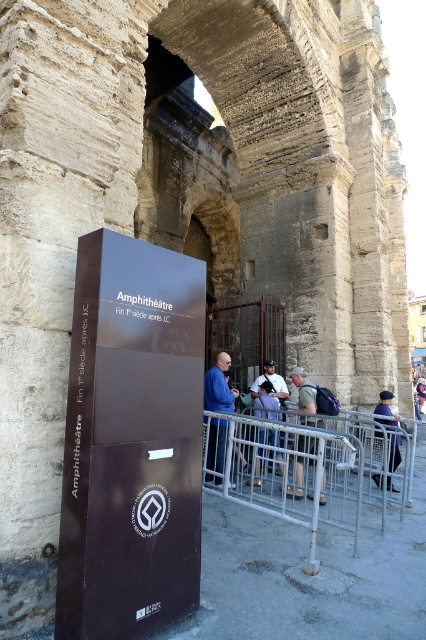
Which is behind, point (397, 490) or point (255, 385)?

Point (255, 385)

Where is `purple fabric bag at lower right`? This screenshot has width=426, height=640. purple fabric bag at lower right is located at coordinates (385, 408).

What are the coordinates of `purple fabric bag at lower right` in the screenshot? It's located at (385, 408).

Can you confirm if khaki cotton shirt at center is shorter than white fabric shirt at center?

Correct, khaki cotton shirt at center is not as tall as white fabric shirt at center.

Between khaki cotton shirt at center and white fabric shirt at center, which one has less height?

Standing shorter between the two is khaki cotton shirt at center.

Where is `khaki cotton shirt at center`? The width and height of the screenshot is (426, 640). khaki cotton shirt at center is located at coordinates (304, 390).

Can you confirm if blue fabric jacket at center is positioned above purple fabric bag at lower right?

Yes, blue fabric jacket at center is above purple fabric bag at lower right.

In order to click on blue fabric jacket at center in this screenshot , I will do `click(218, 387)`.

Is point (213, 452) farther from viewer compared to point (400, 436)?

No, (213, 452) is closer to viewer.

Identify the location of blue fabric jacket at center. (218, 387).